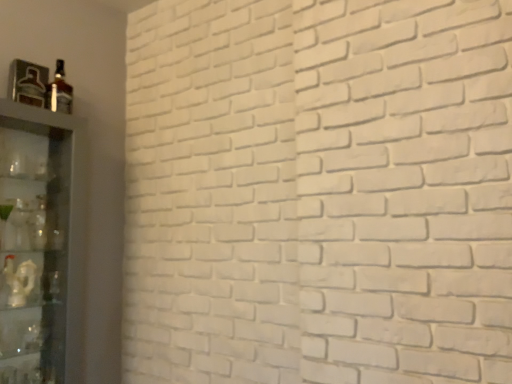
Question: Should I look upward or downward to see clear glass shelf at left?

Choices:
 (A) down
 (B) up

Answer: (A)

Question: Considering the relative sizes of clear glass shelf at left and matte glass bottle at upper left, which is the first bottle from right to left, in the image provided, is clear glass shelf at left bigger than matte glass bottle at upper left, which is the first bottle from right to left,?

Choices:
 (A) yes
 (B) no

Answer: (A)

Question: Is the depth of clear glass shelf at left less than that of matte glass bottle at upper left, acting as the second bottle starting from the left?

Choices:
 (A) yes
 (B) no

Answer: (A)

Question: Is clear glass shelf at left facing away from matte glass bottle at upper left, acting as the second bottle starting from the left?

Choices:
 (A) yes
 (B) no

Answer: (B)

Question: From the image's perspective, does clear glass shelf at left appear lower than matte glass bottle at upper left, which is the first bottle from right to left?

Choices:
 (A) no
 (B) yes

Answer: (B)

Question: Does clear glass shelf at left appear on the right side of matte glass bottle at upper left, acting as the second bottle starting from the left?

Choices:
 (A) no
 (B) yes

Answer: (A)

Question: Is clear glass shelf at left outside matte glass bottle at upper left, acting as the second bottle starting from the left?

Choices:
 (A) no
 (B) yes

Answer: (B)

Question: From the image's perspective, does metallic glass bottle at upper left, which is counted as the 2th bottle, starting from the right, appear higher than clear glass shelf at left?

Choices:
 (A) yes
 (B) no

Answer: (A)

Question: From the image's perspective, does metallic glass bottle at upper left, placed as the first bottle when sorted from left to right, appear lower than clear glass shelf at left?

Choices:
 (A) yes
 (B) no

Answer: (B)

Question: Is metallic glass bottle at upper left, placed as the first bottle when sorted from left to right, not inside clear glass shelf at left?

Choices:
 (A) no
 (B) yes

Answer: (B)

Question: Is metallic glass bottle at upper left, which is counted as the 2th bottle, starting from the right, with clear glass shelf at left?

Choices:
 (A) yes
 (B) no

Answer: (B)

Question: Does metallic glass bottle at upper left, which is counted as the 2th bottle, starting from the right, have a greater width compared to clear glass shelf at left?

Choices:
 (A) yes
 (B) no

Answer: (B)

Question: Is metallic glass bottle at upper left, placed as the first bottle when sorted from left to right, aimed at clear glass shelf at left?

Choices:
 (A) no
 (B) yes

Answer: (A)

Question: Is matte glass bottle at upper left, acting as the second bottle starting from the left, positioned in front of metallic glass bottle at upper left, which is counted as the 2th bottle, starting from the right?

Choices:
 (A) yes
 (B) no

Answer: (B)